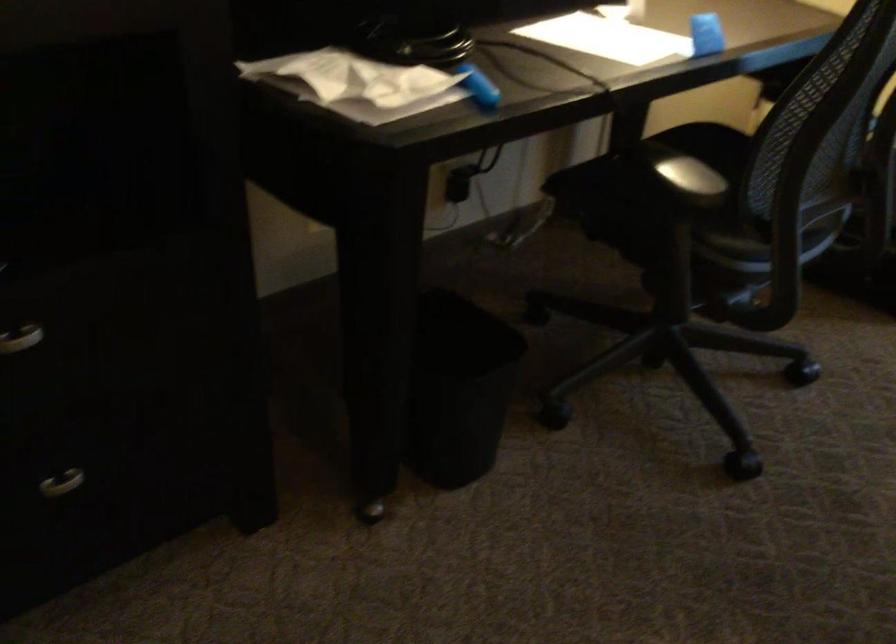
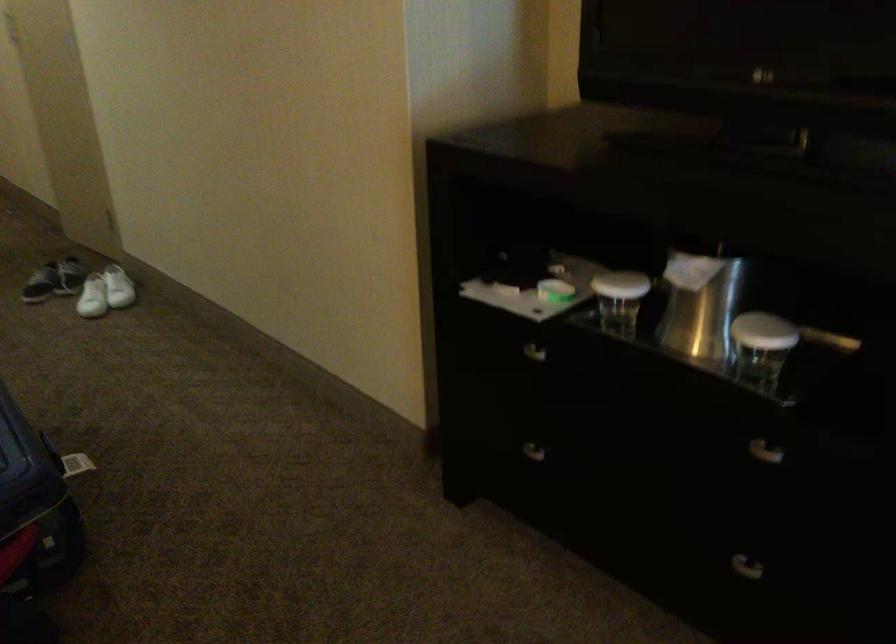
The images are taken continuously from a first-person perspective. In which direction is your viewpoint rotating?

The camera's rotation is toward left-down.